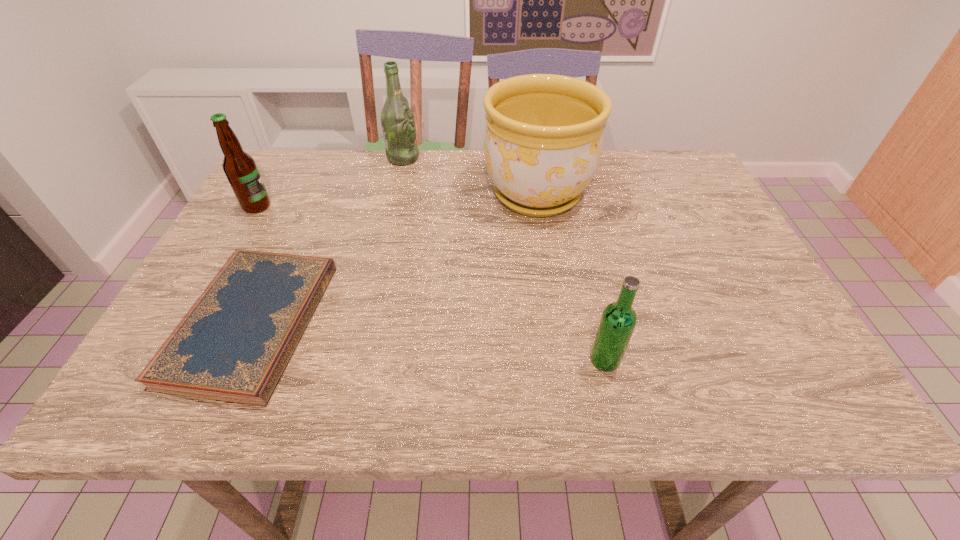
Where is `vacant position located on the right of the nearest beer bottle`? The height and width of the screenshot is (540, 960). vacant position located on the right of the nearest beer bottle is located at coordinates (723, 360).

The width and height of the screenshot is (960, 540). Identify the location of vacant space located on the right of the paperback book. (461, 323).

Image resolution: width=960 pixels, height=540 pixels. Identify the location of beer bottle located in the far edge section of the desktop. (397, 119).

Where is `flowerpot present at the far edge`? Image resolution: width=960 pixels, height=540 pixels. flowerpot present at the far edge is located at coordinates (543, 140).

At what (x,y) coordinates should I click in order to perform the action: click on beer bottle that is at the near edge. Please return your answer as a coordinate pair (x, y). The width and height of the screenshot is (960, 540). Looking at the image, I should click on (618, 320).

Where is `paperback book that is at the near edge`? This screenshot has width=960, height=540. paperback book that is at the near edge is located at coordinates (235, 342).

This screenshot has height=540, width=960. Identify the location of beer bottle that is at the left edge. (239, 167).

This screenshot has width=960, height=540. What are the coordinates of `paperback book located in the left edge section of the desktop` in the screenshot? It's located at (235, 342).

Image resolution: width=960 pixels, height=540 pixels. I want to click on object located at the near left corner, so click(x=235, y=342).

Locate an element on the screen. The image size is (960, 540). free space at the far edge of the desktop is located at coordinates (453, 197).